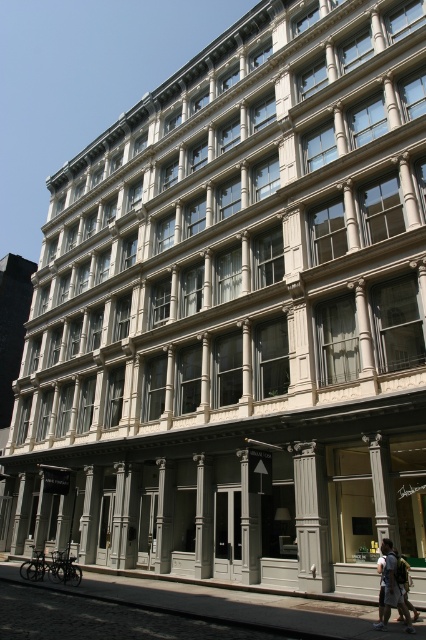
Question: Does white painted wood column at center appear under white cotton backpack at center?

Choices:
 (A) no
 (B) yes

Answer: (A)

Question: Does white painted wood column at center appear over gray concrete column at center?

Choices:
 (A) yes
 (B) no

Answer: (A)

Question: Does white painted wood column at center appear under white cotton backpack at center?

Choices:
 (A) yes
 (B) no

Answer: (B)

Question: Which of the following is the closest to the observer?

Choices:
 (A) gray stone pillar at center
 (B) white painted wood column at center

Answer: (B)

Question: Which of the following is the closest to the observer?

Choices:
 (A) (204, 522)
 (B) (322, 547)
 (C) (389, 586)

Answer: (C)

Question: Which point is farther to the camera?

Choices:
 (A) gray stone pillar at center
 (B) white painted wood column at center

Answer: (A)